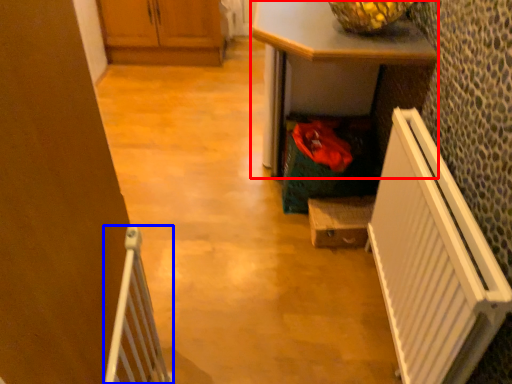
Question: Among these objects, which one is nearest to the camera, desk (highlighted by a red box) or radiator (highlighted by a blue box)?

Choices:
 (A) desk
 (B) radiator

Answer: (B)